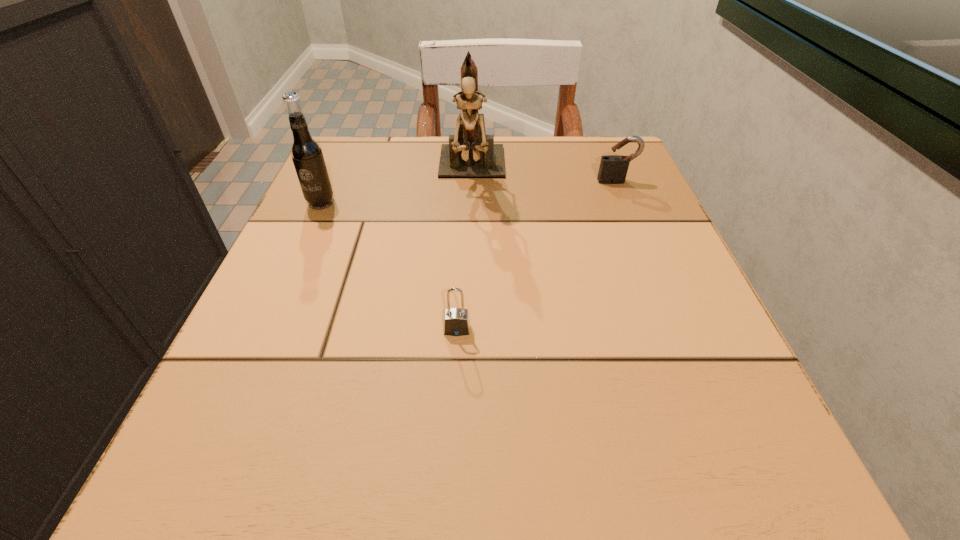
In order to click on figurine in this screenshot , I will do `click(471, 153)`.

At what (x,y) coordinates should I click in order to perform the action: click on root beer. Please return your answer as a coordinate pair (x, y). This screenshot has width=960, height=540. Looking at the image, I should click on (306, 153).

Image resolution: width=960 pixels, height=540 pixels. Identify the location of the second tallest object. (306, 153).

This screenshot has width=960, height=540. What are the coordinates of `the third tallest object` in the screenshot? It's located at (615, 167).

Where is `the right padlock`? the right padlock is located at coordinates (615, 167).

Where is `the shorter padlock`? the shorter padlock is located at coordinates (456, 320).

I want to click on the left padlock, so click(456, 320).

Locate an element on the screen. Image resolution: width=960 pixels, height=540 pixels. vacant point located on the front-facing side of the tallest object is located at coordinates (469, 261).

In order to click on vacant region located on the label of the root beer in this screenshot , I will do `click(240, 383)`.

Locate an element on the screen. vacant space located 0.180m with the keyhole on the front of the taller padlock is located at coordinates (641, 241).